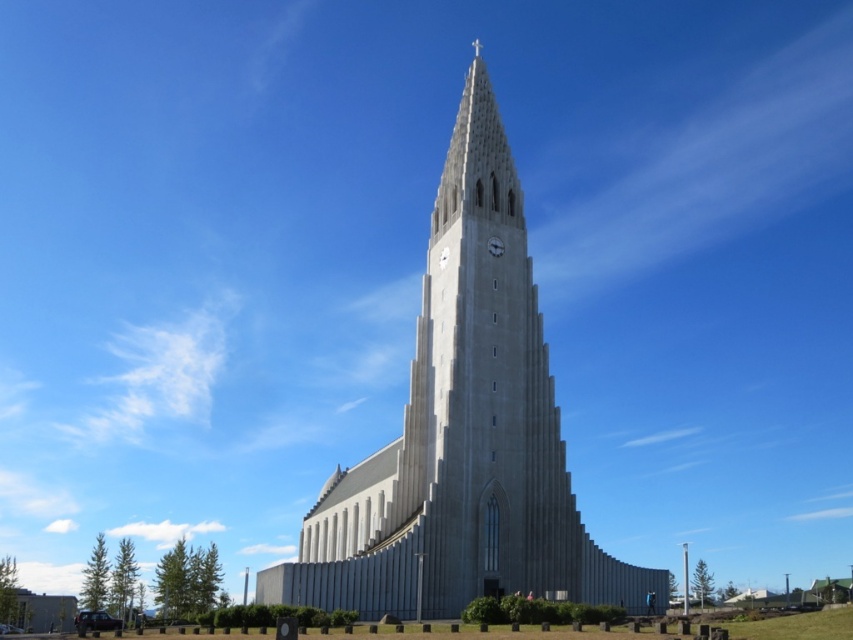
Question: From the image, what is the correct spatial relationship of gray stone church at center in relation to metallic gray clock at center?

Choices:
 (A) below
 (B) above

Answer: (A)

Question: Does gray stone church at center have a larger size compared to metallic gray clock at center?

Choices:
 (A) no
 (B) yes

Answer: (B)

Question: Which point is farther from the camera taking this photo?

Choices:
 (A) (463, 608)
 (B) (502, 243)

Answer: (B)

Question: Does gray stone church at center appear on the right side of metallic gray clock at center?

Choices:
 (A) yes
 (B) no

Answer: (B)

Question: Which point is farther to the camera?

Choices:
 (A) tap(492, 248)
 (B) tap(624, 605)

Answer: (A)